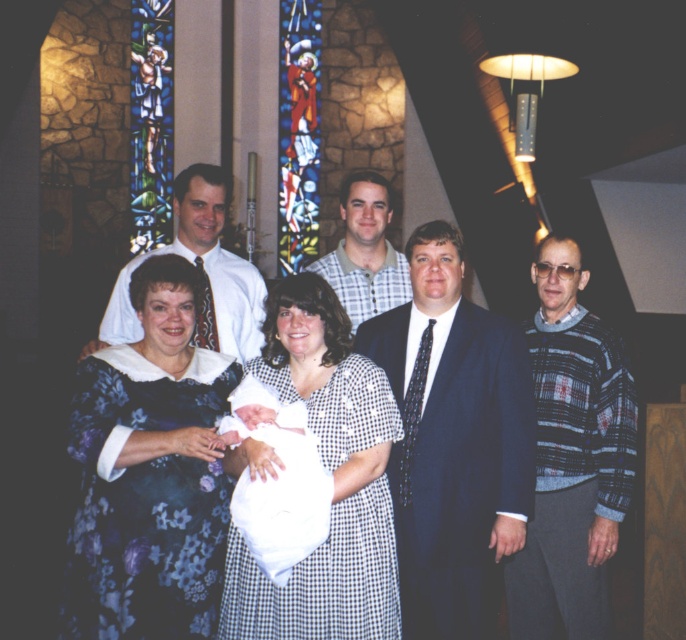
In the image of the family gathering at the church, there is a point marked at coordinates (333, 481). Which object from the scene is located at this point?

The point at coordinates (333, 481) indicates the location of the white checkered dress at center.

You are standing at the entrance of the church and see two points marked in the image. The first point is at coordinate point (626, 483) and the second point is at coordinate point (368, 394). Which point is closer to you?

Point (626, 483) is in front of point (368, 394), so it is closer to you.